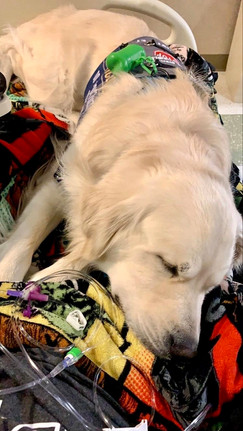
The image size is (243, 431). In order to click on wall in this screenshot , I will do `click(208, 13)`.